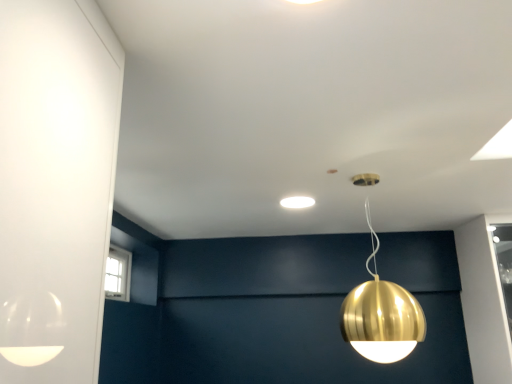
In order to click on gold metallic sphere at upper center, positioned as the 1th lamp in right-to-left order in this screenshot , I will do `click(381, 315)`.

This screenshot has width=512, height=384. Describe the element at coordinates (381, 315) in the screenshot. I see `gold metallic sphere at upper center, arranged as the 2th lamp when viewed from the left` at that location.

Identify the location of white matte light fixture at center, arranged as the first lamp when viewed from the top. Image resolution: width=512 pixels, height=384 pixels. (297, 202).

This screenshot has width=512, height=384. What do you see at coordinates (297, 202) in the screenshot? I see `white matte light fixture at center, arranged as the first lamp when viewed from the top` at bounding box center [297, 202].

Locate an element on the screen. The image size is (512, 384). gold metallic sphere at upper center, positioned as the 1th lamp in right-to-left order is located at coordinates (381, 315).

Based on the photo, between gold metallic sphere at upper center, positioned as the 1th lamp in front-to-back order, and white matte light fixture at center, which is counted as the 1th lamp, starting from the back, which one appears on the right side from the viewer's perspective?

gold metallic sphere at upper center, positioned as the 1th lamp in front-to-back order, is more to the right.

Which object is further away from the camera taking this photo, gold metallic sphere at upper center, which is the 1th lamp in bottom-to-top order, or white matte light fixture at center, which is counted as the 2th lamp, starting from the bottom?

white matte light fixture at center, which is counted as the 2th lamp, starting from the bottom, is behind.

Which point is more forward, (358,291) or (306,202)?

The point (358,291) is closer to the camera.

From the image's perspective, is gold metallic sphere at upper center, the second lamp from the top, above or below white matte light fixture at center, arranged as the first lamp when viewed from the top?

gold metallic sphere at upper center, the second lamp from the top, is situated lower than white matte light fixture at center, arranged as the first lamp when viewed from the top, in the image.

From the picture: From a real-world perspective, between gold metallic sphere at upper center, arranged as the 2th lamp when viewed from the left, and white matte light fixture at center, which is the 2th lamp from front to back, who is vertically lower?

gold metallic sphere at upper center, arranged as the 2th lamp when viewed from the left, from a real-world perspective.

Considering the sizes of objects gold metallic sphere at upper center, positioned as the 1th lamp in right-to-left order, and white matte light fixture at center, the first lamp when ordered from left to right, in the image provided, who is thinner, gold metallic sphere at upper center, positioned as the 1th lamp in right-to-left order, or white matte light fixture at center, the first lamp when ordered from left to right,?

Thinner between the two is white matte light fixture at center, the first lamp when ordered from left to right.

Can you confirm if gold metallic sphere at upper center, the second lamp from the top, is shorter than white matte light fixture at center, which is counted as the 2th lamp, starting from the bottom?

Incorrect, the height of gold metallic sphere at upper center, the second lamp from the top, does not fall short of that of white matte light fixture at center, which is counted as the 2th lamp, starting from the bottom.

Considering the relative sizes of gold metallic sphere at upper center, positioned as the 1th lamp in right-to-left order, and white matte light fixture at center, which is the 2th lamp from front to back, in the image provided, is gold metallic sphere at upper center, positioned as the 1th lamp in right-to-left order, smaller than white matte light fixture at center, which is the 2th lamp from front to back,?

No, gold metallic sphere at upper center, positioned as the 1th lamp in right-to-left order, is not smaller than white matte light fixture at center, which is the 2th lamp from front to back.

Is gold metallic sphere at upper center, the second lamp from the top, located outside white matte light fixture at center, the first lamp when ordered from left to right?

Indeed, gold metallic sphere at upper center, the second lamp from the top, is completely outside white matte light fixture at center, the first lamp when ordered from left to right.

Are gold metallic sphere at upper center, which is the 2th lamp in back-to-front order, and white matte light fixture at center, which is the 2th lamp from front to back, making contact?

There is a gap between gold metallic sphere at upper center, which is the 2th lamp in back-to-front order, and white matte light fixture at center, which is the 2th lamp from front to back.

Is gold metallic sphere at upper center, positioned as the 1th lamp in front-to-back order, facing away from white matte light fixture at center, arranged as the first lamp when viewed from the top?

No, gold metallic sphere at upper center, positioned as the 1th lamp in front-to-back order, is not facing away from white matte light fixture at center, arranged as the first lamp when viewed from the top.

What's the angular difference between gold metallic sphere at upper center, which is the 1th lamp in bottom-to-top order, and white matte light fixture at center, the first lamp when ordered from left to right,'s facing directions?

The angular difference between gold metallic sphere at upper center, which is the 1th lamp in bottom-to-top order, and white matte light fixture at center, the first lamp when ordered from left to right, is 90 degrees.

The height and width of the screenshot is (384, 512). Identify the location of lamp located on the right of white matte light fixture at center, the first lamp when ordered from left to right. (381, 315).

Considering the relative positions of white matte light fixture at center, arranged as the first lamp when viewed from the top, and gold metallic sphere at upper center, which is the 2th lamp in back-to-front order, in the image provided, is white matte light fixture at center, arranged as the first lamp when viewed from the top, to the left or to the right of gold metallic sphere at upper center, which is the 2th lamp in back-to-front order,?

In the image, white matte light fixture at center, arranged as the first lamp when viewed from the top, appears on the left side of gold metallic sphere at upper center, which is the 2th lamp in back-to-front order.

Does white matte light fixture at center, arranged as the first lamp when viewed from the top, come behind gold metallic sphere at upper center, positioned as the 1th lamp in right-to-left order?

Yes, white matte light fixture at center, arranged as the first lamp when viewed from the top, is further from the camera.

Is point (301, 206) closer to camera compared to point (368, 204)?

That is False.

From the image's perspective, between white matte light fixture at center, arranged as the first lamp when viewed from the top, and gold metallic sphere at upper center, positioned as the 1th lamp in right-to-left order, who is located below?

gold metallic sphere at upper center, positioned as the 1th lamp in right-to-left order, from the image's perspective.

From a real-world perspective, which is physically above, white matte light fixture at center, which is counted as the 1th lamp, starting from the back, or gold metallic sphere at upper center, arranged as the 2th lamp when viewed from the left?

white matte light fixture at center, which is counted as the 1th lamp, starting from the back, from a real-world perspective.

Can you confirm if white matte light fixture at center, which appears as the second lamp when viewed from the right, is thinner than gold metallic sphere at upper center, which is the 2th lamp in back-to-front order?

Yes.

Between white matte light fixture at center, the first lamp when ordered from left to right, and gold metallic sphere at upper center, which is the 2th lamp in back-to-front order, which one has less height?

white matte light fixture at center, the first lamp when ordered from left to right.

From the picture: In terms of size, does white matte light fixture at center, the first lamp when ordered from left to right, appear bigger or smaller than gold metallic sphere at upper center, the second lamp from the top?

white matte light fixture at center, the first lamp when ordered from left to right, is smaller than gold metallic sphere at upper center, the second lamp from the top.

Consider the image. Is white matte light fixture at center, which is the 2th lamp from front to back, positioned beyond the bounds of gold metallic sphere at upper center, which is the 1th lamp in bottom-to-top order?

Yes.

Is white matte light fixture at center, arranged as the first lamp when viewed from the top, in contact with gold metallic sphere at upper center, positioned as the 1th lamp in right-to-left order?

No, white matte light fixture at center, arranged as the first lamp when viewed from the top, is not in contact with gold metallic sphere at upper center, positioned as the 1th lamp in right-to-left order.

In the scene shown: Could you tell me if white matte light fixture at center, which appears as the second lamp when viewed from the right, is facing gold metallic sphere at upper center, positioned as the 1th lamp in front-to-back order?

No, white matte light fixture at center, which appears as the second lamp when viewed from the right, is not oriented towards gold metallic sphere at upper center, positioned as the 1th lamp in front-to-back order.

How different are the orientations of white matte light fixture at center, arranged as the first lamp when viewed from the top, and gold metallic sphere at upper center, the second lamp from the top, in degrees?

90 degrees separate the facing orientations of white matte light fixture at center, arranged as the first lamp when viewed from the top, and gold metallic sphere at upper center, the second lamp from the top.

How distant is white matte light fixture at center, the first lamp when ordered from left to right, from gold metallic sphere at upper center, positioned as the 1th lamp in right-to-left order?

white matte light fixture at center, the first lamp when ordered from left to right, is 29.41 inches away from gold metallic sphere at upper center, positioned as the 1th lamp in right-to-left order.

The width and height of the screenshot is (512, 384). Find the location of `lamp that is on the right side of white matte light fixture at center, the first lamp when ordered from left to right`. lamp that is on the right side of white matte light fixture at center, the first lamp when ordered from left to right is located at coordinates (381, 315).

At what (x,y) coordinates should I click in order to perform the action: click on lamp above the gold metallic sphere at upper center, positioned as the 1th lamp in front-to-back order (from the image's perspective). Please return your answer as a coordinate pair (x, y). The height and width of the screenshot is (384, 512). Looking at the image, I should click on (297, 202).

Where is `lamp on the left side of gold metallic sphere at upper center, the second lamp from the top`? The width and height of the screenshot is (512, 384). lamp on the left side of gold metallic sphere at upper center, the second lamp from the top is located at coordinates point(297,202).